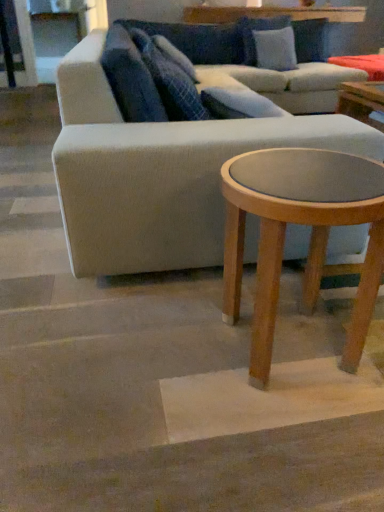
Locate an element on the screen. This screenshot has width=384, height=512. free space above light brown wood coffee table at lower right (from a real-world perspective) is located at coordinates (310, 168).